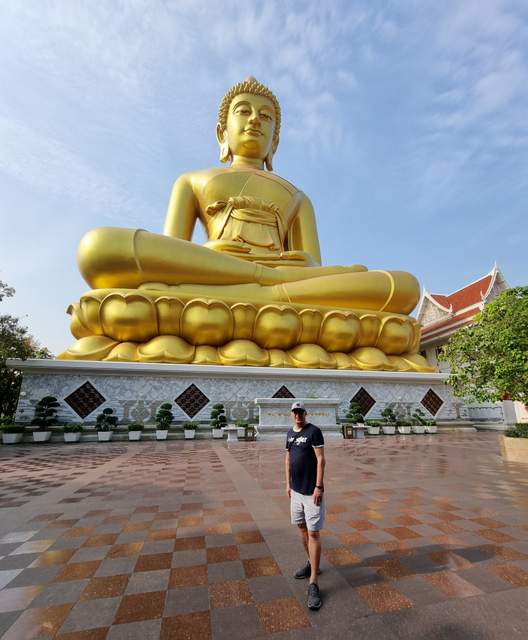
The height and width of the screenshot is (640, 528). I want to click on buddha statue, so click(x=277, y=217).